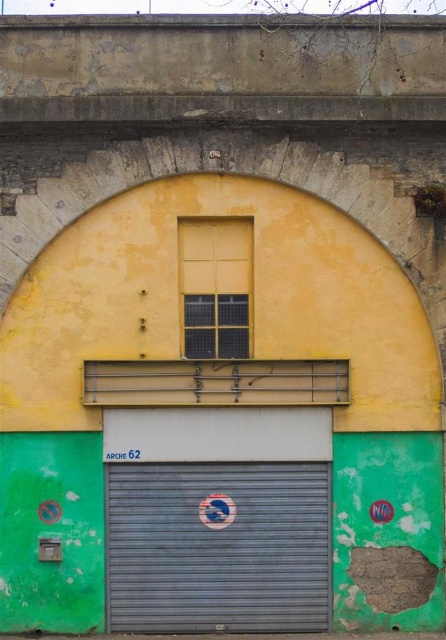
Does point (234, 516) come farther from viewer compared to point (215, 337)?

Yes, it is behind point (215, 337).

Who is higher up, metallic gray garage door at center or yellow matte window at upper center?

yellow matte window at upper center

What do you see at coordinates (218, 547) in the screenshot? I see `metallic gray garage door at center` at bounding box center [218, 547].

Find the location of a particular element. The height and width of the screenshot is (640, 446). metallic gray garage door at center is located at coordinates 218,547.